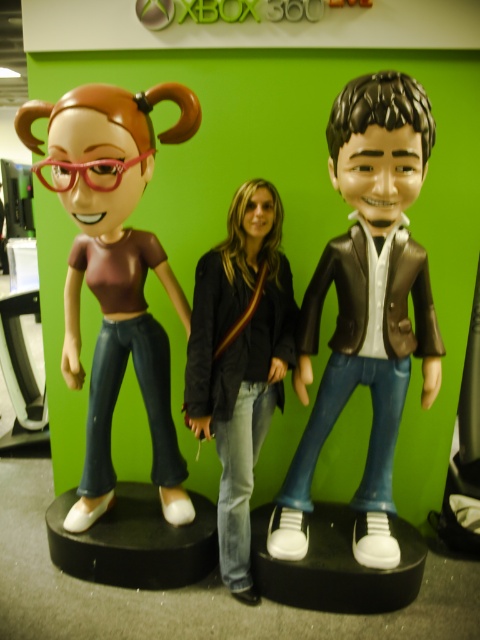
You are a delivery robot with a package that needs to be placed between the matte black bobblehead at right and the denim jeans at center. The package is 30 centimeters wide. Can you fit it in the space between them?

The distance between the matte black bobblehead at right and the denim jeans at center is 29.00 centimeters, so the 30 centimeter wide package cannot fit in the space between them.

You are standing in front of the XBOX 360 LIVE wall and see the matte black bobblehead at right and the matte brown bobblehead at left. Which bobblehead is closer to you?

The matte black bobblehead at right is closer to you because it is in front of the matte brown bobblehead at left.

You are a collector who wants to display both the matte brown bobblehead at left and the denim jeans at center on a shelf. The shelf has limited space, and you need to know which item takes up more space. Based on the scene description, which item is bigger?

The matte brown bobblehead at left has a larger size compared to denim jeans at center, so the matte brown bobblehead at left takes up more space and is bigger.